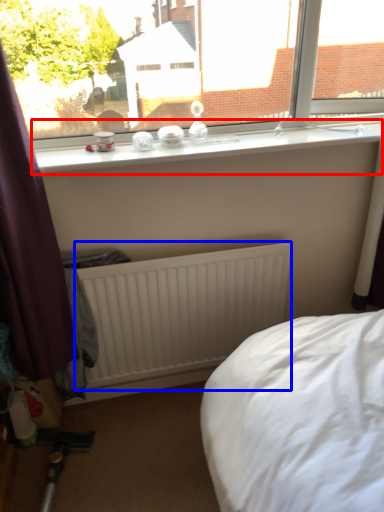
Question: Which point is closer to the camera, window sill (highlighted by a red box) or radiator (highlighted by a blue box)?

Choices:
 (A) window sill
 (B) radiator

Answer: (A)